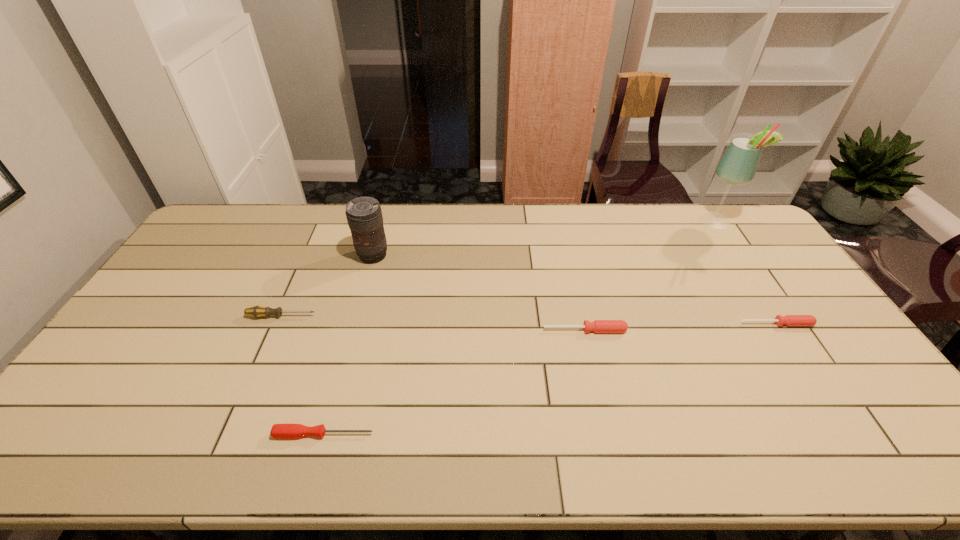
This screenshot has width=960, height=540. What are the coordinates of `free space at the far edge` in the screenshot? It's located at (627, 220).

Where is `vacant space at the near edge of the desktop`? This screenshot has width=960, height=540. vacant space at the near edge of the desktop is located at coordinates (652, 447).

The height and width of the screenshot is (540, 960). What are the coordinates of `free space between the third screwdriver from right to left and the rightmost screwdriver` in the screenshot? It's located at (550, 379).

Find the location of a particular element. The height and width of the screenshot is (540, 960). unoccupied area between the fifth shortest object and the leftmost screwdriver is located at coordinates (327, 286).

Where is `vacant area that lies between the fourth object from left to right and the second screwdriver from left to right`? This screenshot has width=960, height=540. vacant area that lies between the fourth object from left to right and the second screwdriver from left to right is located at coordinates (454, 382).

You are a GUI agent. You are given a task and a screenshot of the screen. Output one action in this format:
    pyautogui.click(x=<x>, y=<y>)
    Task: Click on the vacant region between the second farthest object and the second screwdriver from left to right
    The image size is (960, 540).
    Given the screenshot: What is the action you would take?
    pyautogui.click(x=348, y=345)

Locate an element on the screen. free spot between the farthest object and the leftmost object is located at coordinates (499, 268).

At what (x,y) coordinates should I click in order to perform the action: click on free spot between the leftmost screwdriver and the farthest object. Please return your answer as a coordinate pair (x, y). Image resolution: width=960 pixels, height=540 pixels. Looking at the image, I should click on (499, 268).

This screenshot has width=960, height=540. Identify the location of vacant area that lies between the nearest screwdriver and the second tallest object. (348, 345).

Locate an element on the screen. This screenshot has width=960, height=540. empty location between the alcohol and the fourth object from left to right is located at coordinates (651, 275).